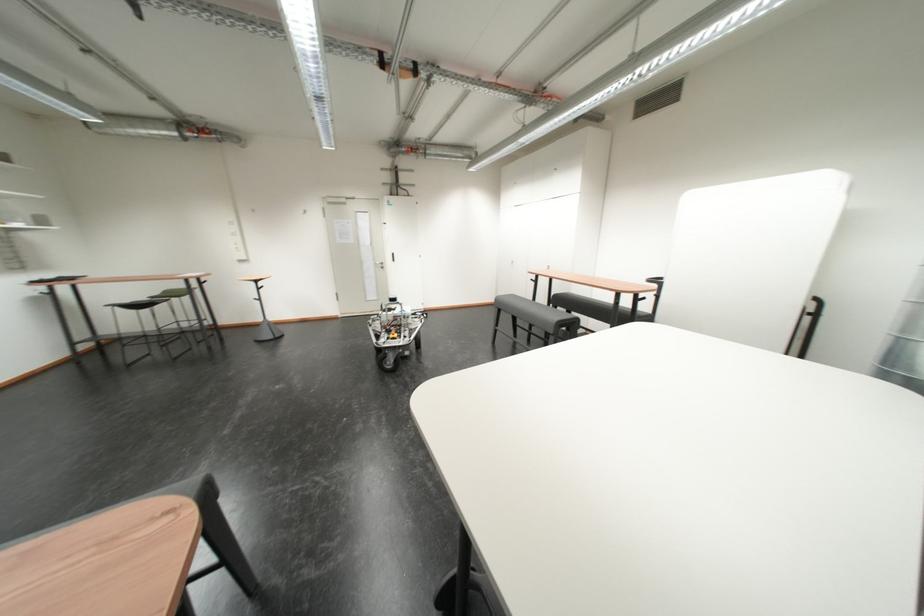
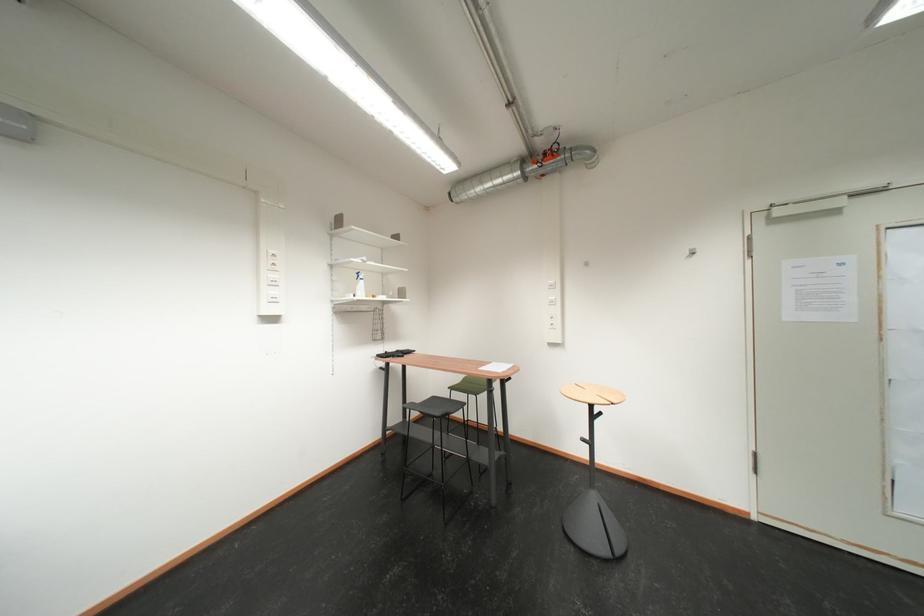
Find the pixel in the second image that matches point (207, 132) in the first image.

(552, 160)